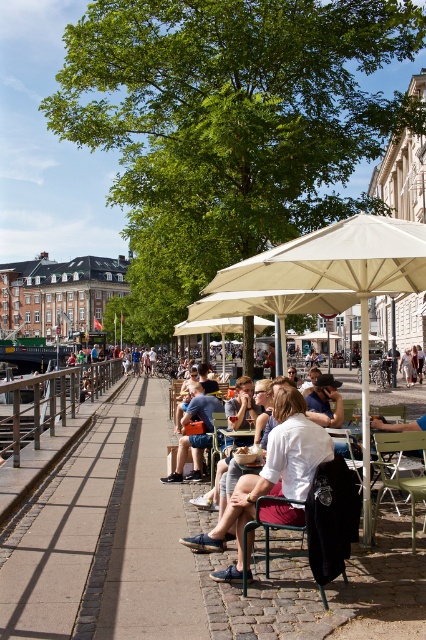
Which is more to the left, white cotton shirt at center or denim shorts at center?

denim shorts at center is more to the left.

You are a GUI agent. You are given a task and a screenshot of the screen. Output one action in this format:
    pyautogui.click(x=<x>, y=<y>)
    Task: Click on the white cotton shirt at center
    Image resolution: width=426 pixels, height=640 pixels.
    Given the screenshot: What is the action you would take?
    pyautogui.click(x=270, y=476)